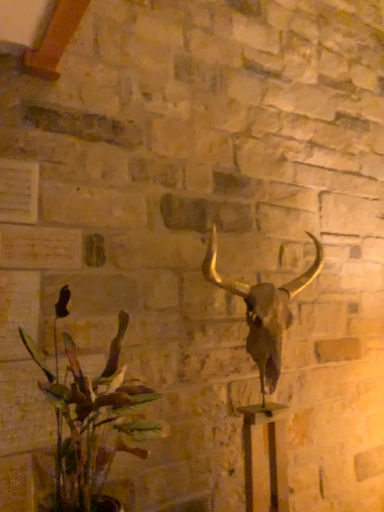
Image resolution: width=384 pixels, height=512 pixels. Describe the element at coordinates (91, 419) in the screenshot. I see `green leafy plant at left` at that location.

What is the approximate width of green leafy plant at left?

green leafy plant at left is 14.77 inches wide.

The width and height of the screenshot is (384, 512). Identify the location of green leafy plant at left. (91, 419).

Where is `green leafy plant at left`? green leafy plant at left is located at coordinates (91, 419).